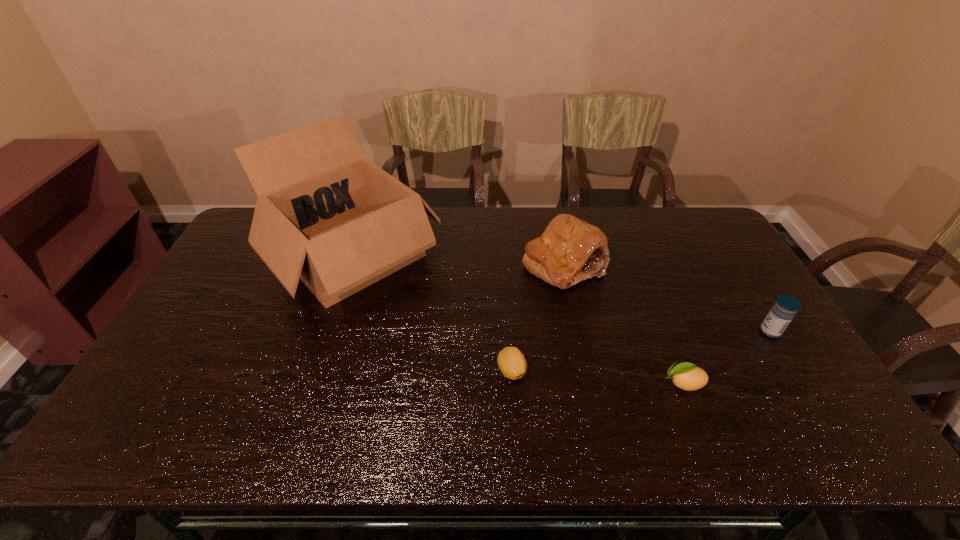
This screenshot has width=960, height=540. I want to click on free space between the fourth object from left to right and the tallest object, so click(x=518, y=320).

Identify the location of empty space that is in between the second object from left to right and the box. (432, 313).

Locate an element on the screen. vacant area that lies between the left lemon and the third farthest object is located at coordinates (640, 351).

You are a GUI agent. You are given a task and a screenshot of the screen. Output one action in this format:
    pyautogui.click(x=<x>, y=<y>)
    Task: Click on the vacant area that lies between the fourth object from left to right and the third object from left to right
    The image size is (960, 540).
    Given the screenshot: What is the action you would take?
    [x=623, y=324]

Identify the location of unoccupied position between the second object from left to right and the third nearest object. (640, 351).

Identify which object is the third nearest to the tallest object. Please provide its 2D coordinates. Your answer should be formatted as a tuple, i.e. [(x, y)], where the tuple contains the x and y coordinates of a point satisfying the conditions above.

[(687, 376)]

Locate which object is the second closest to the second tallest object. Please provide its 2D coordinates. Your answer should be formatted as a tuple, i.e. [(x, y)], where the tuple contains the x and y coordinates of a point satisfying the conditions above.

[(325, 214)]

The image size is (960, 540). Find the location of `vacant space that satisfies the following two spatial constraints: 1. on the front side of the medicine; 2. with leaves positioned above the fourth object from left to right`. vacant space that satisfies the following two spatial constraints: 1. on the front side of the medicine; 2. with leaves positioned above the fourth object from left to right is located at coordinates (803, 383).